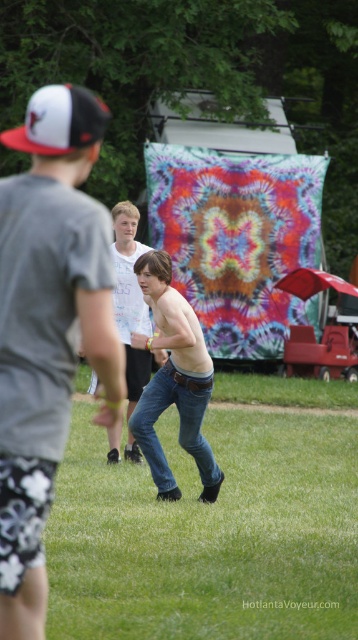
You are standing at the center of the image. Which direction should you move to reach the green grass at center?

The green grass at center is located at point coordinates of (209, 536), so you should move towards the right and slightly downward from the center to reach it.

You are standing at the edge of a grassy area and want to place a picnic blanket that requires 5 meters of space. Can you fit it on the green grass at center?

The distance between you and the green grass at center is 4.80 meters, which is less than the required 5 meters. Therefore, the picnic blanket will not fit.